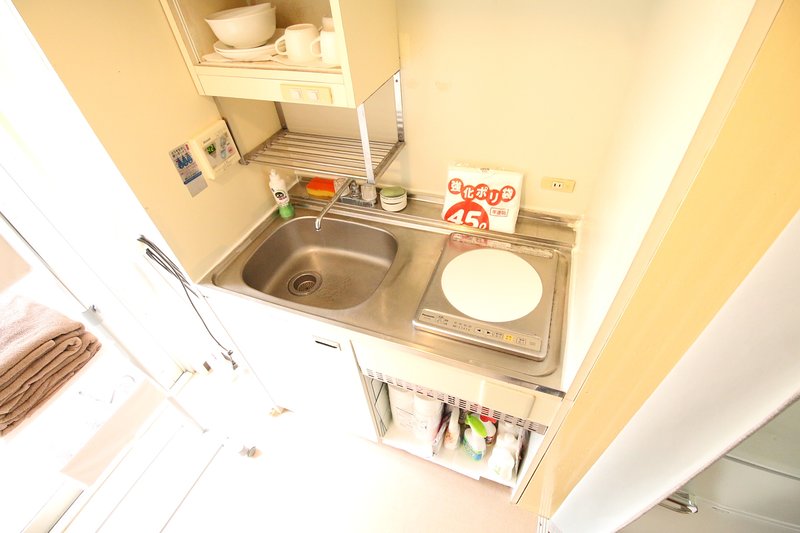
You are a GUI agent. You are given a task and a screenshot of the screen. Output one action in this format:
    pyautogui.click(x=<x>, y=<y>)
    Task: Click on the white plate
    The width and height of the screenshot is (800, 533).
    Given the screenshot: What is the action you would take?
    pyautogui.click(x=250, y=54)